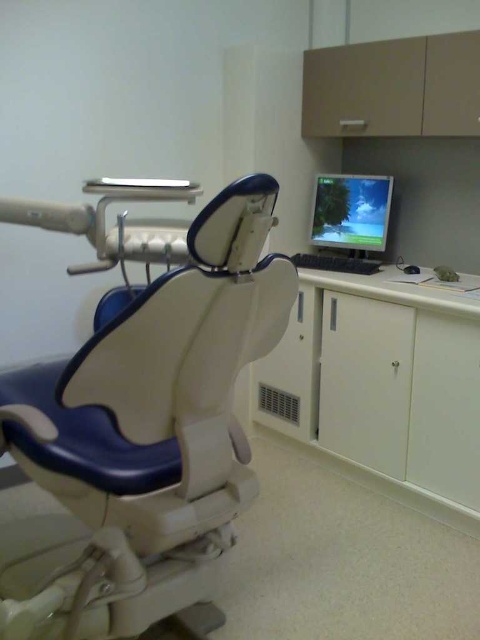
You are a patient entering the dental clinic and need to sit down. There is a white leather swivel chair at left and a white glossy cabinet at lower right. Which one is bigger in size?

The white leather swivel chair at left is larger in size compared to the white glossy cabinet at lower right.

You are a patient in a dental clinic and need to sit down. There is a white leather swivel chair at left and a matte plastic monitor at upper right. Which object is located to the left of the other?

The white leather swivel chair at left is positioned on the left side of the matte plastic monitor at upper right.